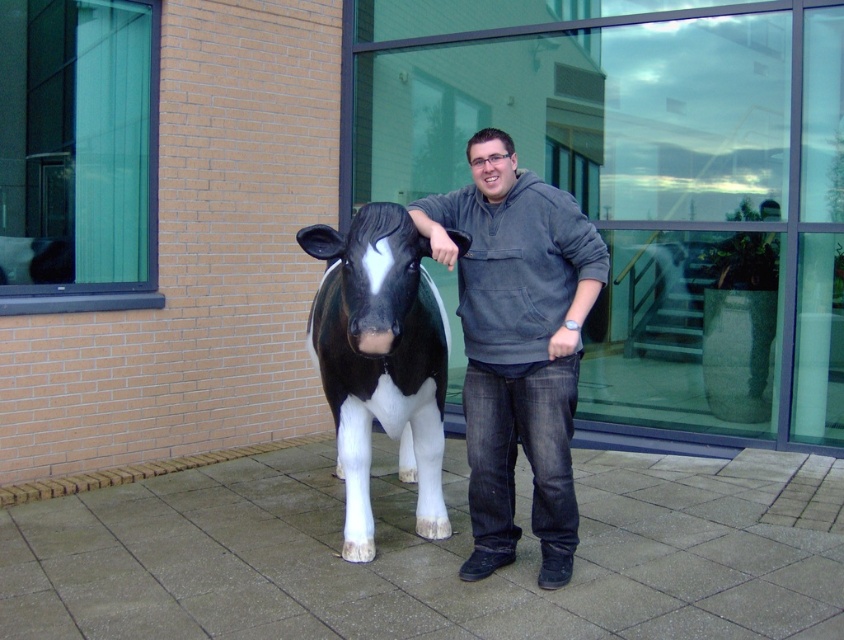
You are a photographer trying to capture the man and the cow statue in a balanced composition. Given that the gray hoodie at center is positioned at coordinates approximately 0.539 on the x and 0.614 on the y axis, where should you place the center of your camera frame to ensure the man is centered?

To center the man in the frame, position the camera frame center at the coordinates provided for the gray hoodie at center, which is approximately 0.539 on the x and 0.614 on the y axis, as this is where the man is located.

You are a photographer trying to capture a photo of the gray hoodie at center and the black glossy plastic bull at center. If you want to ensure both subjects are in focus, which one should you focus on first according to the depth of field principle?

Since the gray hoodie at center is taller than the black glossy plastic bull at center, you should focus on the gray hoodie at center first to ensure both are in focus.